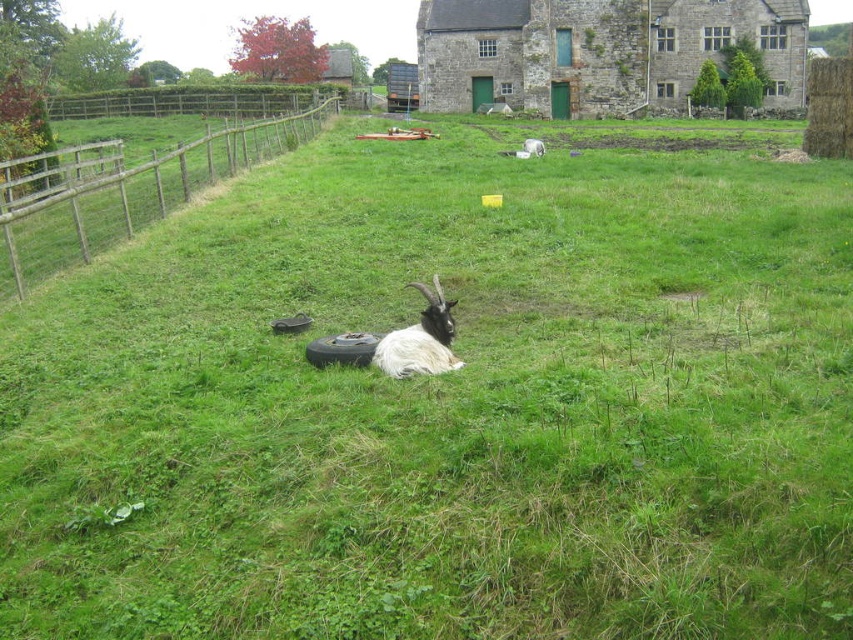
Can you confirm if white fluffy goat at center is positioned above white woolen sheep at center?

No, white fluffy goat at center is not above white woolen sheep at center.

Between white fluffy goat at center and white woolen sheep at center, which one has less height?

white fluffy goat at center is shorter.

Is point (444, 314) positioned in front of point (532, 141)?

Yes, point (444, 314) is closer to viewer.

Find the location of `white fluffy goat at center`. white fluffy goat at center is located at coordinates (421, 339).

Which is behind, point (165, 212) or point (410, 284)?

The point (165, 212) is behind.

The height and width of the screenshot is (640, 853). I want to click on brown wooden fence at left, so click(x=131, y=195).

Between brown wooden fence at left and white woolen sheep at center, which one has less height?

white woolen sheep at center

Between brown wooden fence at left and white woolen sheep at center, which one is positioned higher?

brown wooden fence at left

Who is more forward, (x=48, y=234) or (x=527, y=145)?

Point (x=48, y=234)

Identify the location of brown wooden fence at left. (131, 195).